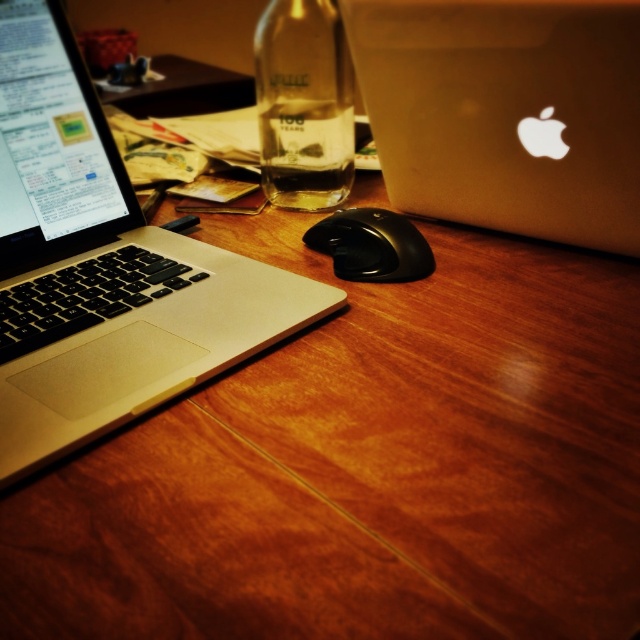
You are a delivery person who needs to place a small package on the desk without blocking the view of the clear glass bottle at center. The package will be placed on the desk surface. Where should you place the package to ensure the bottle remains visible?

The clear glass bottle at center is 27.80 inches from the viewer, so placing the package closer to the edge of the desk away from the bottle or behind the laptop and mouse would keep the bottle visible without blocking it.

You are organizing your desk and need to place a new item between the silver metallic laptop at left and the edge of the desk. Based on the laptop location at point 0.417, 0.163, where should you position the new item?

The silver metallic laptop at left is located at point (x=104, y=266). To place the new item between it and the desk edge, position it along the same axis but closer to the edge, ensuring it lies between the laptop and the desk boundary.

You are trying to place a new object at the coordinates point (104, 266). However, there is already an object there. What is the object at that location?

The silver metallic laptop at left is located at point (104, 266).